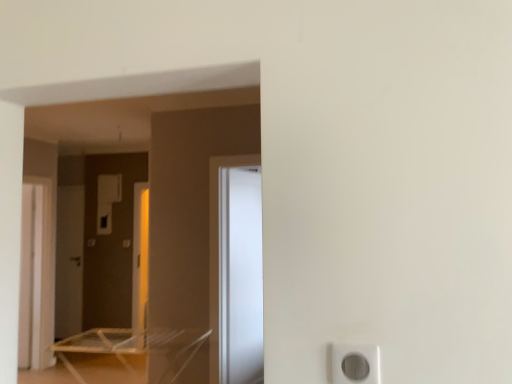
Question: Visually, is clear plastic table at lower left positioned to the left or to the right of matte brown screen door at left, the 3th screen door viewed from the right?

Choices:
 (A) right
 (B) left

Answer: (A)

Question: Relative to matte brown screen door at left, acting as the first screen door starting from the left, is clear plastic table at lower left in front or behind?

Choices:
 (A) behind
 (B) front

Answer: (B)

Question: Which of these objects is positioned closest to the matte brown screen door at left, the 3th screen door viewed from the right?

Choices:
 (A) clear plastic table at lower left
 (B) white glossy screen door at center, marked as the 3th screen door in a left-to-right arrangement
 (C) white plastic screen door at left, placed as the 2th screen door when sorted from left to right
 (D) white glossy electric outlet at lower right

Answer: (C)

Question: Estimate the real-world distances between objects in this image. Which object is closer to the clear plastic table at lower left?

Choices:
 (A) white glossy screen door at center, which is the 3th screen door from back to front
 (B) white glossy electric outlet at lower right
 (C) matte brown screen door at left, acting as the first screen door starting from the left
 (D) white plastic screen door at left, placed as the 2th screen door when sorted from left to right

Answer: (D)